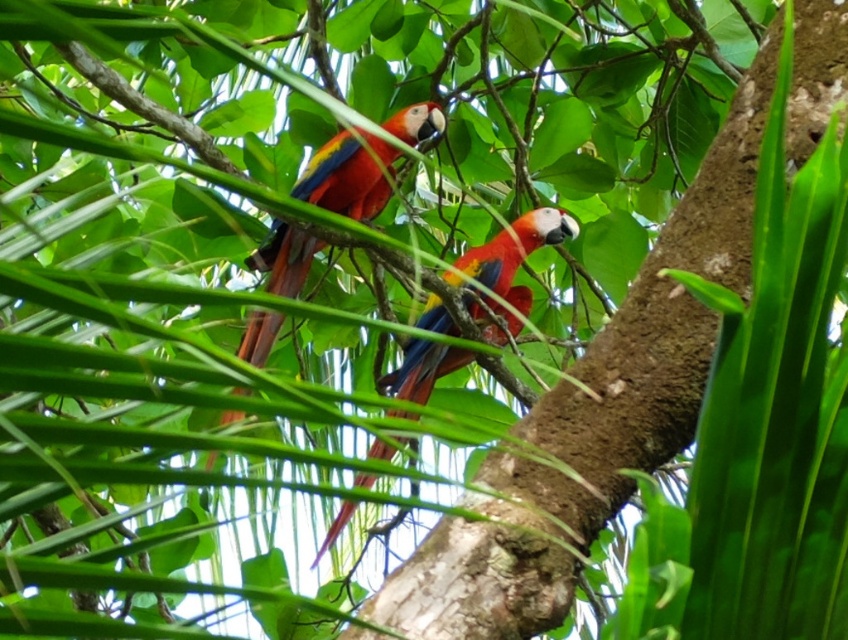
Which of these two, glossy feathers parrot at center or shiny multicolored parrot at center, stands shorter?

With less height is glossy feathers parrot at center.

Does glossy feathers parrot at center appear under shiny multicolored parrot at center?

No, glossy feathers parrot at center is not below shiny multicolored parrot at center.

What do you see at coordinates (343, 179) in the screenshot?
I see `glossy feathers parrot at center` at bounding box center [343, 179].

Where is `glossy feathers parrot at center`? This screenshot has height=640, width=848. glossy feathers parrot at center is located at coordinates (343, 179).